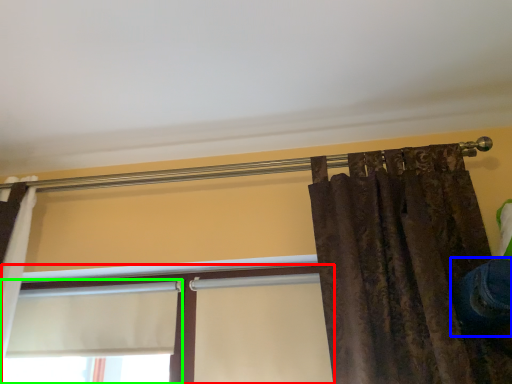
Question: Which object is the farthest from window (highlighted by a red box)? Choose among these: jeans (highlighted by a blue box) or window (highlighted by a green box).

Choices:
 (A) jeans
 (B) window

Answer: (A)